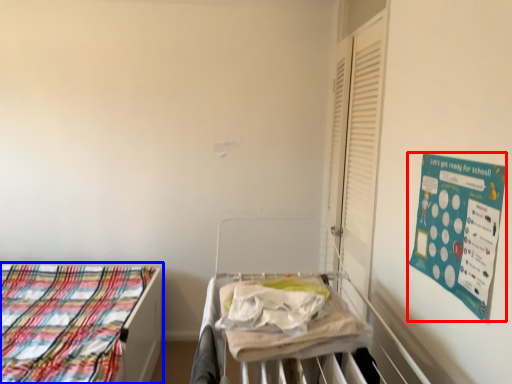
Question: Among these objects, which one is farthest to the camera, poster (highlighted by a red box) or bed (highlighted by a blue box)?

Choices:
 (A) poster
 (B) bed

Answer: (B)